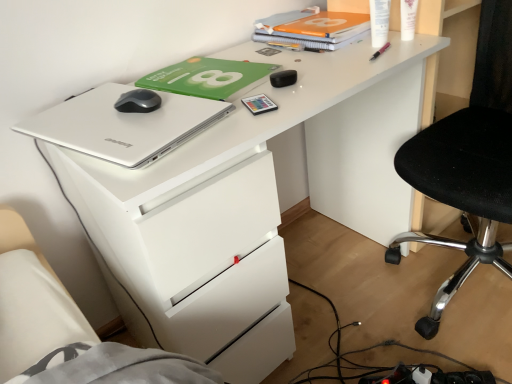
Locate an element on the screen. vacant space in between matte plastic card at center, placed as the 5th stationery when sorted from right to left, and white plastic bottle at upper right, acting as the second stationery starting from the right is located at coordinates (324, 73).